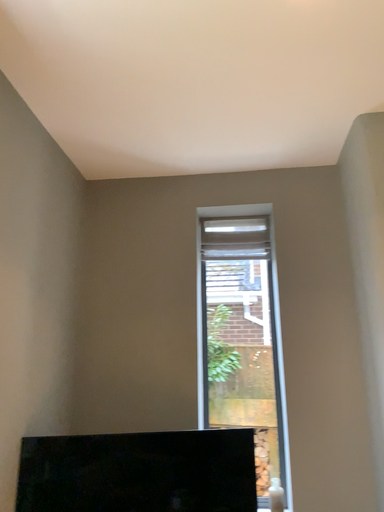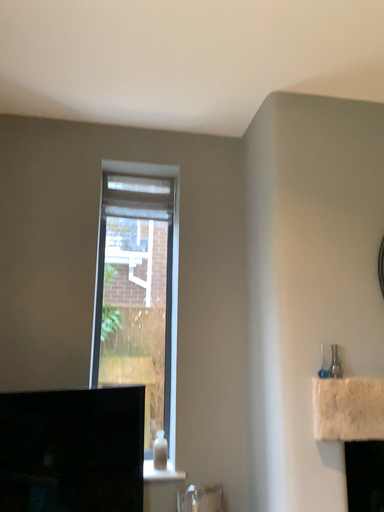
Question: Which way did the camera rotate in the video?

Choices:
 (A) rotated upward
 (B) rotated downward

Answer: (B)